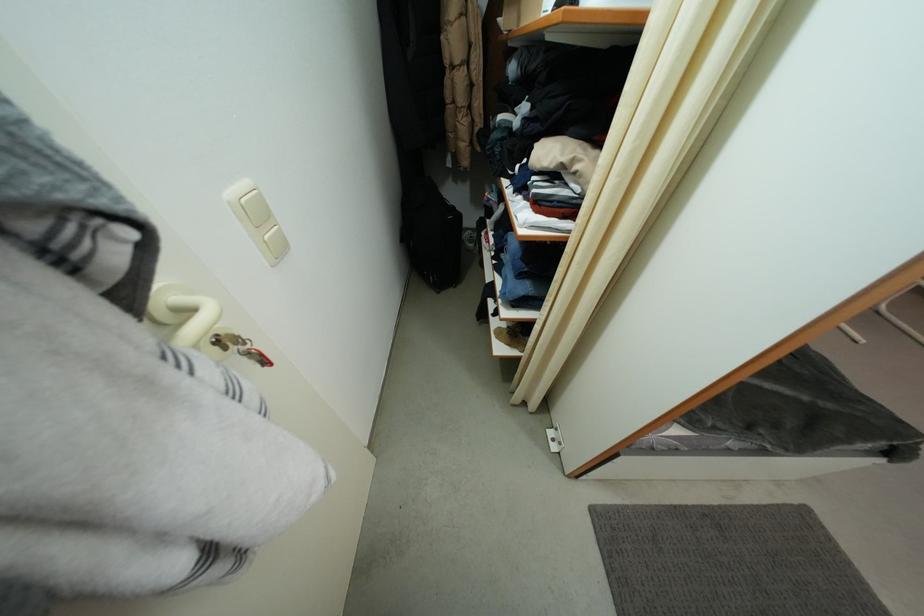
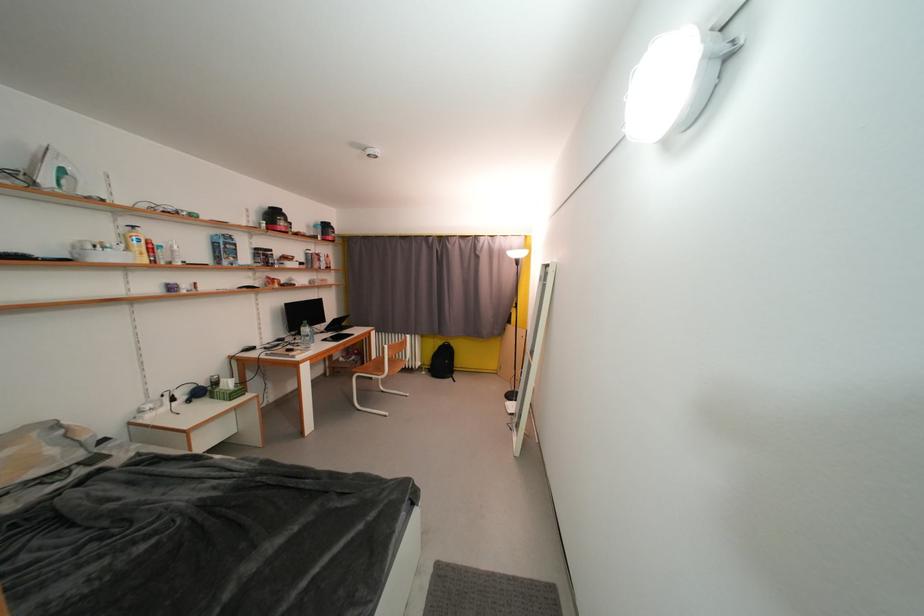
Question: Based on the continuous images, in which direction is the camera rotating? Reply with the corresponding letter.

Choices:
 (A) Left
 (B) Right
 (C) Up
 (D) Down

Answer: (B)